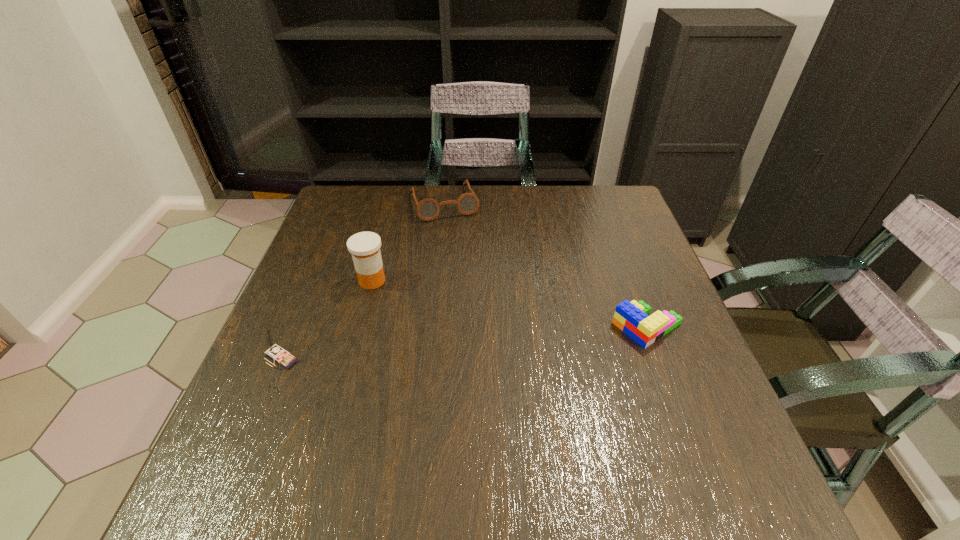
Locate an element on the screen. free space between the shortest object and the matchbox is located at coordinates (465, 342).

I want to click on free space between the third object from left to right and the Lego, so click(545, 265).

Find the location of `vacant point located between the matchbox and the medicine`. vacant point located between the matchbox and the medicine is located at coordinates (327, 319).

Select which object appears as the third closest to the second object from right to left. Please provide its 2D coordinates. Your answer should be formatted as a tuple, i.e. [(x, y)], where the tuple contains the x and y coordinates of a point satisfying the conditions above.

[(279, 355)]

Find the location of a particular element. the closest object relative to the second shortest object is located at coordinates (364, 246).

Find the location of a particular element. The width and height of the screenshot is (960, 540). free space in the image that satisfies the following two spatial constraints: 1. on the back side of the matchbox; 2. on the left side of the medicine is located at coordinates (314, 281).

In order to click on free point that satisfies the following two spatial constraints: 1. on the back side of the second object from left to right; 2. on the left side of the leftmost object in this screenshot , I will do tap(314, 281).

I want to click on vacant region that satisfies the following two spatial constraints: 1. on the back side of the shortest object; 2. on the left side of the leftmost object, so click(295, 326).

Image resolution: width=960 pixels, height=540 pixels. What are the coordinates of `blank area in the image that satisfies the following two spatial constraints: 1. on the back side of the leftmost object; 2. on the right side of the rightmost object` in the screenshot? It's located at (295, 326).

You are a GUI agent. You are given a task and a screenshot of the screen. Output one action in this format:
    pyautogui.click(x=<x>, y=<y>)
    Task: Click on the free location that satisfies the following two spatial constraints: 1. on the back side of the leftmost object; 2. on the right side of the shortest object
    This screenshot has height=540, width=960.
    Given the screenshot: What is the action you would take?
    pos(295,326)